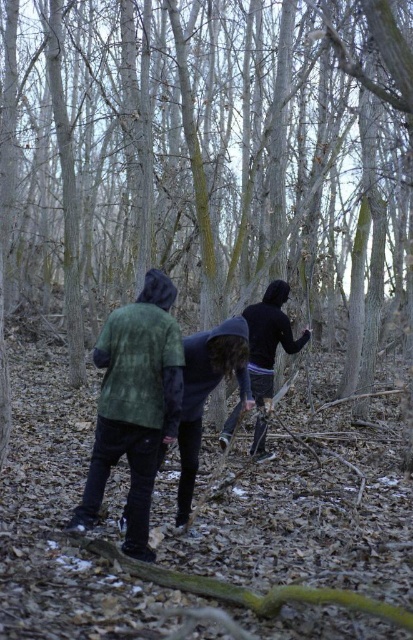
You are planning to take a photo of the smooth bark tree at center and the black matte jacket at center. Which object will appear wider in the photo?

The smooth bark tree at center will appear wider in the photo because its width is larger than that of the black matte jacket at center.

You are standing in the woods and see two people walking ahead of you. They are wearing the green corduroy jacket at left and the black matte jacket at center. Which person is shorter?

The green corduroy jacket at left is shorter than the black matte jacket at center, so the person wearing the green corduroy jacket at left is shorter.